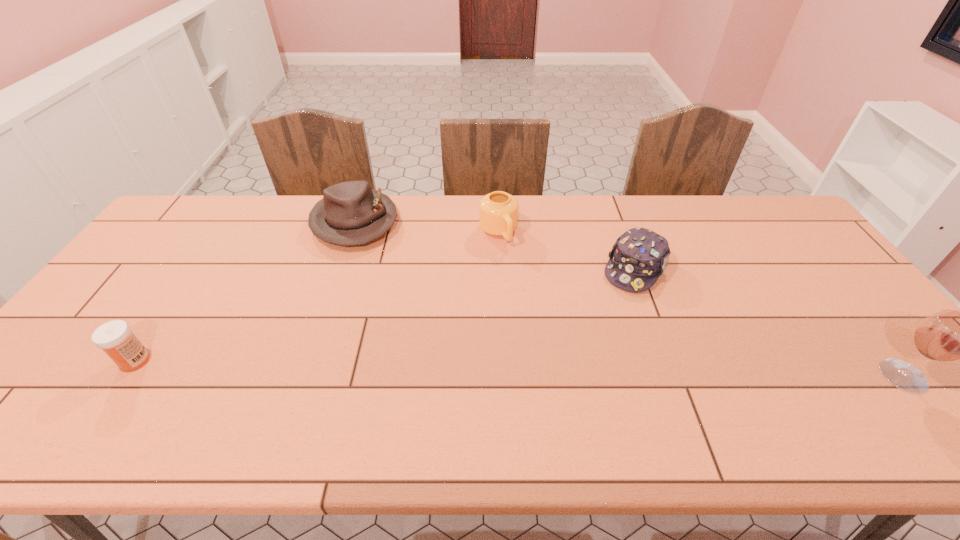
Where is `vacant space that satisfies the following two spatial constraints: 1. on the front side of the mug; 2. on the right side of the hat`? Image resolution: width=960 pixels, height=540 pixels. vacant space that satisfies the following two spatial constraints: 1. on the front side of the mug; 2. on the right side of the hat is located at coordinates click(351, 232).

Where is `vacant point that satisfies the following two spatial constraints: 1. on the front side of the rightmost object; 2. on the right side of the mug`? This screenshot has height=540, width=960. vacant point that satisfies the following two spatial constraints: 1. on the front side of the rightmost object; 2. on the right side of the mug is located at coordinates (x=505, y=376).